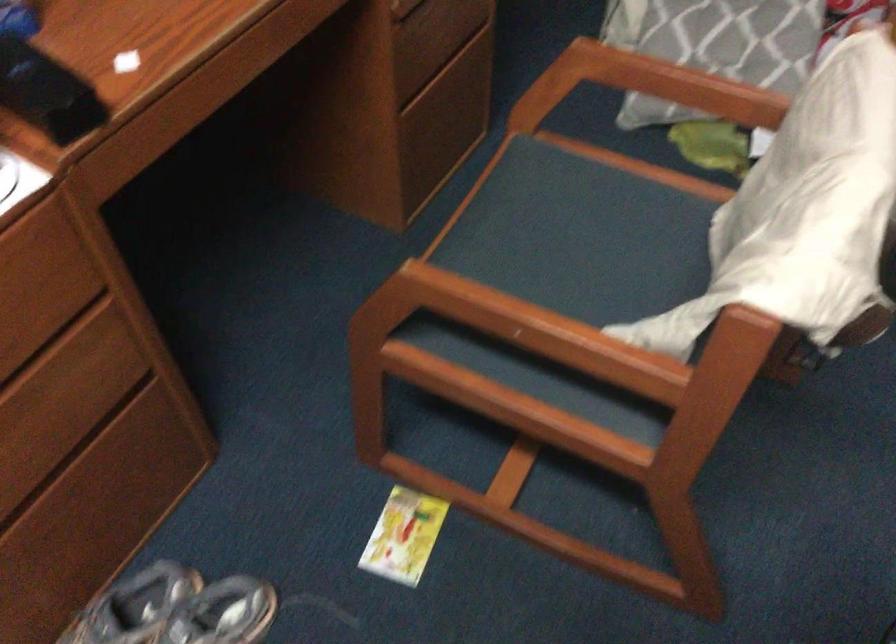
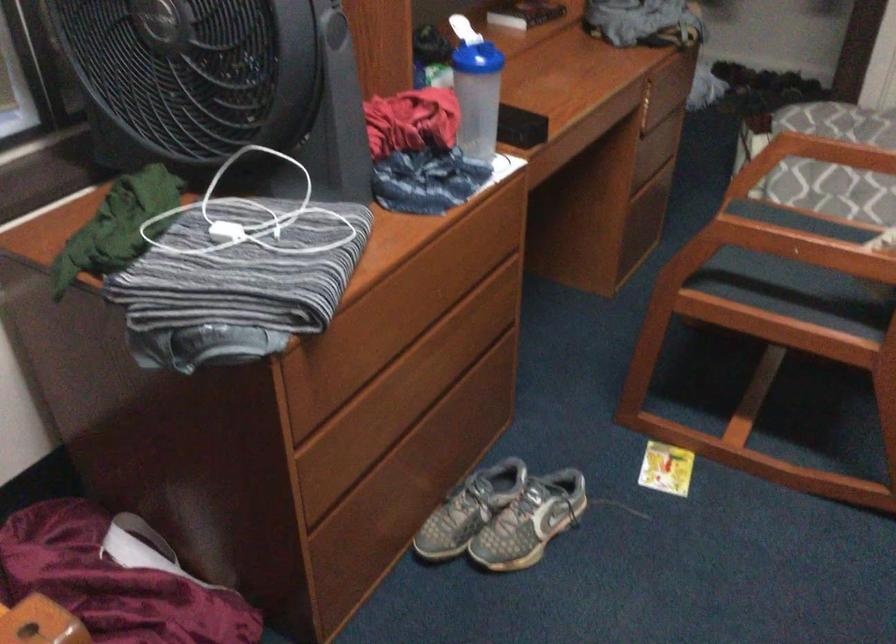
The point at (400, 538) is marked in the first image. Where is the corresponding point in the second image?

(666, 468)